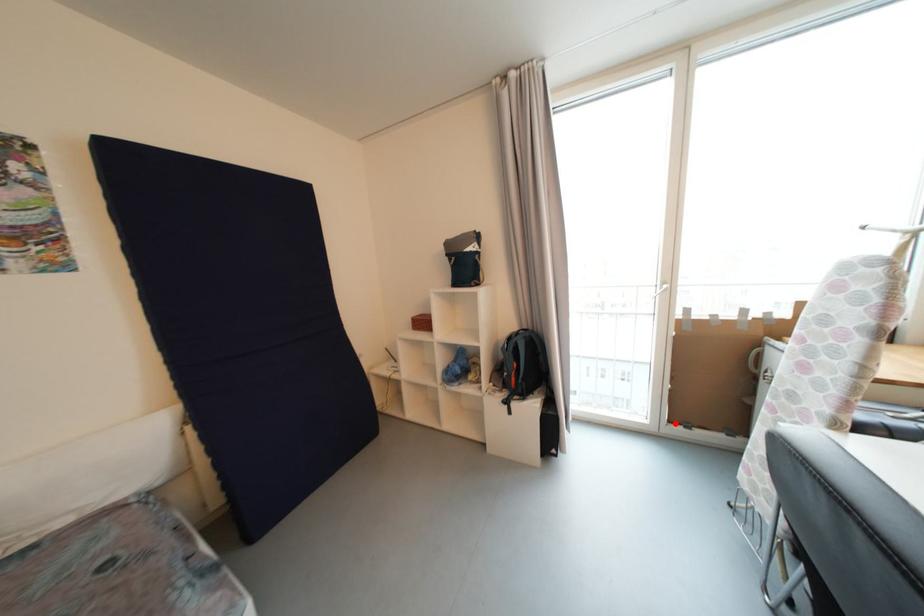
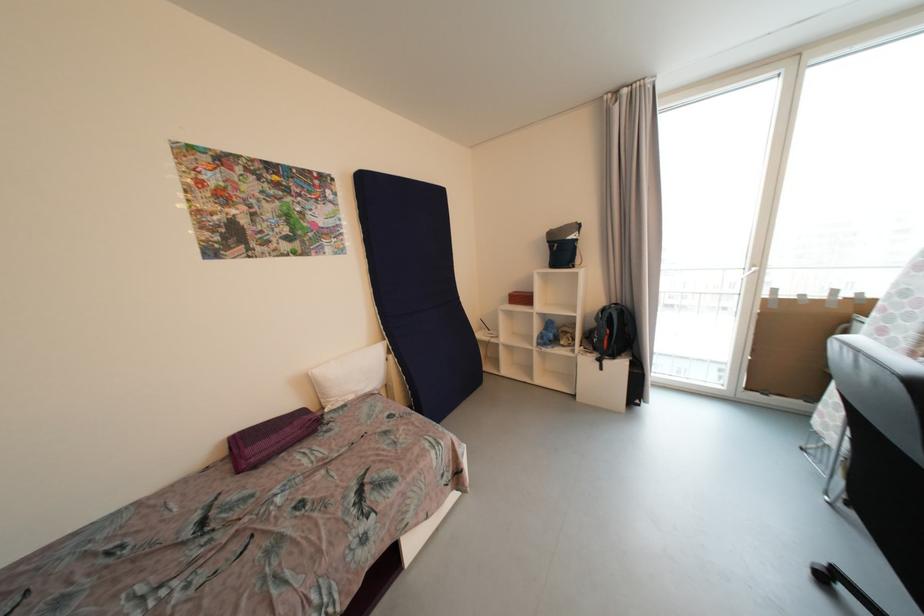
Question: I am providing you with two images of the same scene from different viewpoints. A red point is shown in image1. For the corresponding object point in image2, is it positioned nearer or farther from the camera?

Choices:
 (A) Nearer
 (B) Farther

Answer: (B)